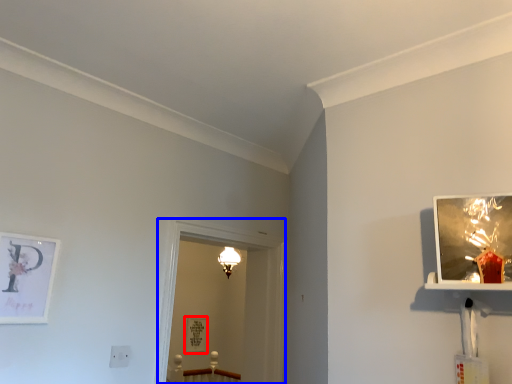
Question: Which object is further to the camera taking this photo, picture frame (highlighted by a red box) or glass door (highlighted by a blue box)?

Choices:
 (A) picture frame
 (B) glass door

Answer: (A)